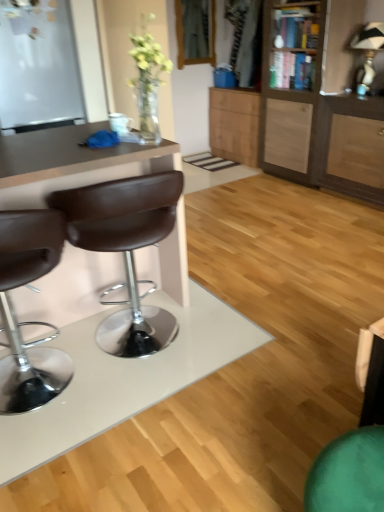
Locate an element on the screen. vacant area that is situated to the right of brown leather stool at left, placed as the 2th chair when sorted from right to left is located at coordinates (141, 404).